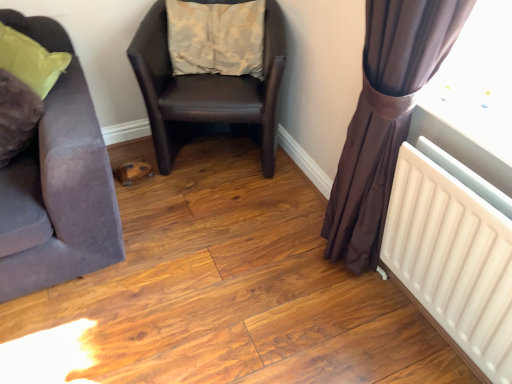
Find the location of a particular element. brown sheer curtain at right is located at coordinates (385, 118).

What are the coordinates of `suede-like brown chair at left, placed as the 1th chair when sorted from left to right` in the screenshot? It's located at (57, 184).

What is the approximate width of white plastic radiator at lower right?

white plastic radiator at lower right is 4.54 inches wide.

What are the coordinates of `brown sheer curtain at right` in the screenshot? It's located at (385, 118).

Which object is wider, suede-like brown chair at left, placed as the 1th chair when sorted from left to right, or beige fabric pillow at center?

suede-like brown chair at left, placed as the 1th chair when sorted from left to right, is wider.

Is suede-like brown chair at left, placed as the 1th chair when sorted from left to right, not close to beige fabric pillow at center?

suede-like brown chair at left, placed as the 1th chair when sorted from left to right, is actually quite close to beige fabric pillow at center.

From the image's perspective, which object appears higher, suede-like brown chair at left, placed as the 1th chair when sorted from left to right, or beige fabric pillow at center?

beige fabric pillow at center is shown above in the image.

Considering the relative positions of suede-like brown chair at left, which is the 2th chair from right to left, and beige fabric pillow at center in the image provided, is suede-like brown chair at left, which is the 2th chair from right to left, in front of beige fabric pillow at center?

Yes, suede-like brown chair at left, which is the 2th chair from right to left, is closer to the camera.

From the image's perspective, does white plastic radiator at lower right appear lower than suede-like brown chair at left, which is the 2th chair from right to left?

Yes, from the image's perspective, white plastic radiator at lower right is beneath suede-like brown chair at left, which is the 2th chair from right to left.

Is white plastic radiator at lower right to the right of suede-like brown chair at left, placed as the 1th chair when sorted from left to right, from the viewer's perspective?

Yes.

From a real-world perspective, is white plastic radiator at lower right beneath suede-like brown chair at left, which is the 2th chair from right to left?

Indeed, from a real-world perspective, white plastic radiator at lower right is positioned beneath suede-like brown chair at left, which is the 2th chair from right to left.

Looking at the image, does white plastic radiator at lower right seem bigger or smaller compared to suede-like brown chair at left, which is the 2th chair from right to left?

Clearly, white plastic radiator at lower right is smaller in size than suede-like brown chair at left, which is the 2th chair from right to left.

Is there a large distance between brown sheer curtain at right and white plastic radiator at lower right?

brown sheer curtain at right is near white plastic radiator at lower right, not far away.

Does brown sheer curtain at right come in front of white plastic radiator at lower right?

Yes, brown sheer curtain at right is closer to the viewer.

Between brown sheer curtain at right and white plastic radiator at lower right, which one has larger size?

Bigger between the two is brown sheer curtain at right.

Which object is thinner, brown sheer curtain at right or white plastic radiator at lower right?

Thinner between the two is white plastic radiator at lower right.

Between brown leather chair at center, which ranks as the first chair in right-to-left order, and beige fabric pillow at center, which one has larger width?

brown leather chair at center, which ranks as the first chair in right-to-left order, is wider.

From the image's perspective, is brown leather chair at center, which ranks as the first chair in right-to-left order, above beige fabric pillow at center?

No.

From a real-world perspective, which is physically above, brown leather chair at center, which ranks as the second chair in left-to-right order, or beige fabric pillow at center?

beige fabric pillow at center, from a real-world perspective.

Based on their sizes in the image, would you say brown leather chair at center, which ranks as the first chair in right-to-left order, is bigger or smaller than beige fabric pillow at center?

Considering their sizes, brown leather chair at center, which ranks as the first chair in right-to-left order, takes up more space than beige fabric pillow at center.

How distant is beige fabric pillow at center from suede-like brown chair at left, which is the 2th chair from right to left?

beige fabric pillow at center is 29.26 inches from suede-like brown chair at left, which is the 2th chair from right to left.

Could you tell me if beige fabric pillow at center is facing suede-like brown chair at left, placed as the 1th chair when sorted from left to right?

No, beige fabric pillow at center is not facing towards suede-like brown chair at left, placed as the 1th chair when sorted from left to right.

Does beige fabric pillow at center have a lesser width compared to suede-like brown chair at left, placed as the 1th chair when sorted from left to right?

Yes.

From a real-world perspective, is brown sheer curtain at right physically located above or below brown leather chair at center, which ranks as the second chair in left-to-right order?

Clearly, from a real-world perspective, brown sheer curtain at right is above brown leather chair at center, which ranks as the second chair in left-to-right order.

Who is shorter, brown sheer curtain at right or brown leather chair at center, which ranks as the second chair in left-to-right order?

brown leather chair at center, which ranks as the second chair in left-to-right order.

Based on the photo, is brown sheer curtain at right thinner than brown leather chair at center, which ranks as the second chair in left-to-right order?

Yes.

Is brown sheer curtain at right not within brown leather chair at center, which ranks as the first chair in right-to-left order?

Indeed, brown sheer curtain at right is completely outside brown leather chair at center, which ranks as the first chair in right-to-left order.

From a real-world perspective, is brown leather chair at center, which ranks as the second chair in left-to-right order, physically located above or below suede-like brown chair at left, which is the 2th chair from right to left?

Clearly, from a real-world perspective, brown leather chair at center, which ranks as the second chair in left-to-right order, is below suede-like brown chair at left, which is the 2th chair from right to left.

Can you confirm if brown leather chair at center, which ranks as the second chair in left-to-right order, is smaller than suede-like brown chair at left, placed as the 1th chair when sorted from left to right?

No.

You are a GUI agent. You are given a task and a screenshot of the screen. Output one action in this format:
    pyautogui.click(x=<x>, y=<y>)
    Task: Click on the chair located behind the suede-like brown chair at left, placed as the 1th chair when sorted from left to right
    This screenshot has height=384, width=512.
    Given the screenshot: What is the action you would take?
    pyautogui.click(x=207, y=91)

From the beige fabric pillow at center, count 2nd chairs forward and point to it. Please provide its 2D coordinates.

[(57, 184)]

The height and width of the screenshot is (384, 512). What are the coordinates of `the 1st chair behind the white plastic radiator at lower right` in the screenshot? It's located at (57, 184).

Which object lies nearer to the anchor point beige fabric pillow at center, brown sheer curtain at right or white plastic radiator at lower right?

The object closer to beige fabric pillow at center is brown sheer curtain at right.

From the image, which object appears to be farther from brown leather chair at center, which ranks as the second chair in left-to-right order, brown sheer curtain at right or beige fabric pillow at center?

brown sheer curtain at right.

Looking at the image, which one is located closer to brown sheer curtain at right, beige fabric pillow at center or white plastic radiator at lower right?

white plastic radiator at lower right is positioned closer to the anchor brown sheer curtain at right.

Estimate the real-world distances between objects in this image. Which object is further from brown leather chair at center, which ranks as the second chair in left-to-right order, white plastic radiator at lower right or beige fabric pillow at center?

Among the two, white plastic radiator at lower right is located further to brown leather chair at center, which ranks as the second chair in left-to-right order.

Looking at the image, which one is located closer to brown leather chair at center, which ranks as the second chair in left-to-right order, white plastic radiator at lower right or brown sheer curtain at right?

brown sheer curtain at right is closer to brown leather chair at center, which ranks as the second chair in left-to-right order.

When comparing their distances from white plastic radiator at lower right, does brown leather chair at center, which ranks as the second chair in left-to-right order, or suede-like brown chair at left, placed as the 1th chair when sorted from left to right, seem closer?

brown leather chair at center, which ranks as the second chair in left-to-right order, lies closer to white plastic radiator at lower right than the other object.

Considering their positions, is beige fabric pillow at center positioned further to white plastic radiator at lower right than brown leather chair at center, which ranks as the second chair in left-to-right order?

beige fabric pillow at center is positioned further to the anchor white plastic radiator at lower right.

Considering their positions, is suede-like brown chair at left, placed as the 1th chair when sorted from left to right, positioned closer to brown sheer curtain at right than beige fabric pillow at center?

Based on the image, beige fabric pillow at center appears to be nearer to brown sheer curtain at right.

The image size is (512, 384). Find the location of `radiator between brown sheer curtain at right and beige fabric pillow at center along the z-axis`. radiator between brown sheer curtain at right and beige fabric pillow at center along the z-axis is located at coordinates (452, 261).

Where is `pillow between suede-like brown chair at left, placed as the 1th chair when sorted from left to right, and brown sheer curtain at right`? The image size is (512, 384). pillow between suede-like brown chair at left, placed as the 1th chair when sorted from left to right, and brown sheer curtain at right is located at coordinates (216, 38).

At what (x,y) coordinates should I click in order to perform the action: click on radiator positioned between brown sheer curtain at right and brown leather chair at center, which ranks as the second chair in left-to-right order, from near to far. Please return your answer as a coordinate pair (x, y). Looking at the image, I should click on (452, 261).

Where is `curtain between suede-like brown chair at left, which is the 2th chair from right to left, and white plastic radiator at lower right from left to right`? curtain between suede-like brown chair at left, which is the 2th chair from right to left, and white plastic radiator at lower right from left to right is located at coordinates (385, 118).